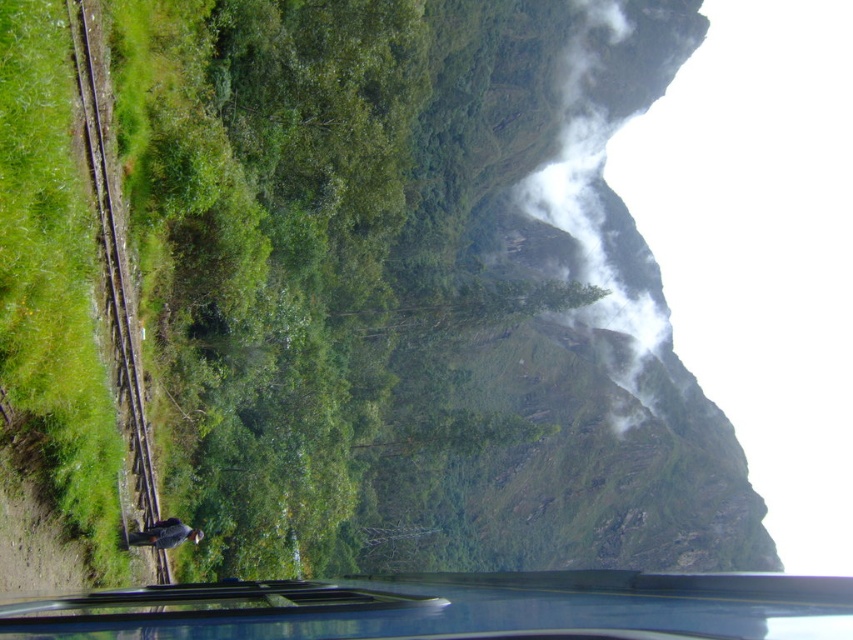
You are a passenger in the car and want to take a photo of the white misty cloud at upper right through the transparent glass car window at lower center. Will the window block your view of the cloud?

The transparent glass car window at lower center is positioned under the white misty cloud at upper right, so the window will not block your view of the cloud.

You are a passenger on a train traveling through this mountainous area. You notice the white misty cloud at upper right and the brown wooden train track at left from your window. If the train is moving towards the direction of the cloud, will you get closer to the cloud or farther away from it?

The white misty cloud at upper right is 983.59 feet away from the brown wooden train track at left. Since the train is moving towards the direction of the cloud, you will get closer to the white misty cloud at upper right as the train progresses along the tracks.